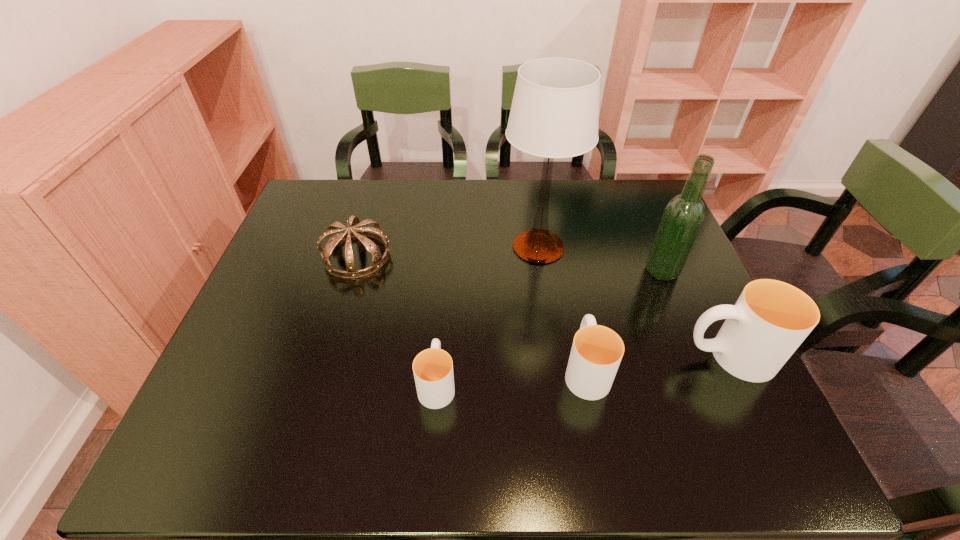
I want to click on the leftmost cup, so click(433, 368).

Find the location of a particular element. The height and width of the screenshot is (540, 960). the fifth object from right to left is located at coordinates (433, 368).

The width and height of the screenshot is (960, 540). What are the coordinates of `the second cup from right to left` in the screenshot? It's located at (596, 353).

The width and height of the screenshot is (960, 540). What are the coordinates of `the tallest cup` in the screenshot? It's located at [x=770, y=320].

Image resolution: width=960 pixels, height=540 pixels. I want to click on the rightmost cup, so click(x=770, y=320).

This screenshot has height=540, width=960. I want to click on tiara, so click(x=361, y=233).

Find the location of a particular element. liquor is located at coordinates (683, 216).

At what (x,y) coordinates should I click in order to perform the action: click on the tallest object. Please return your answer as a coordinate pair (x, y). The image size is (960, 540). Looking at the image, I should click on (555, 109).

The height and width of the screenshot is (540, 960). I want to click on vacant area located 0.130m with the handle on the side of the leftmost cup, so click(443, 314).

Image resolution: width=960 pixels, height=540 pixels. I want to click on vacant area situated with the handle on the side of the leftmost cup, so click(444, 291).